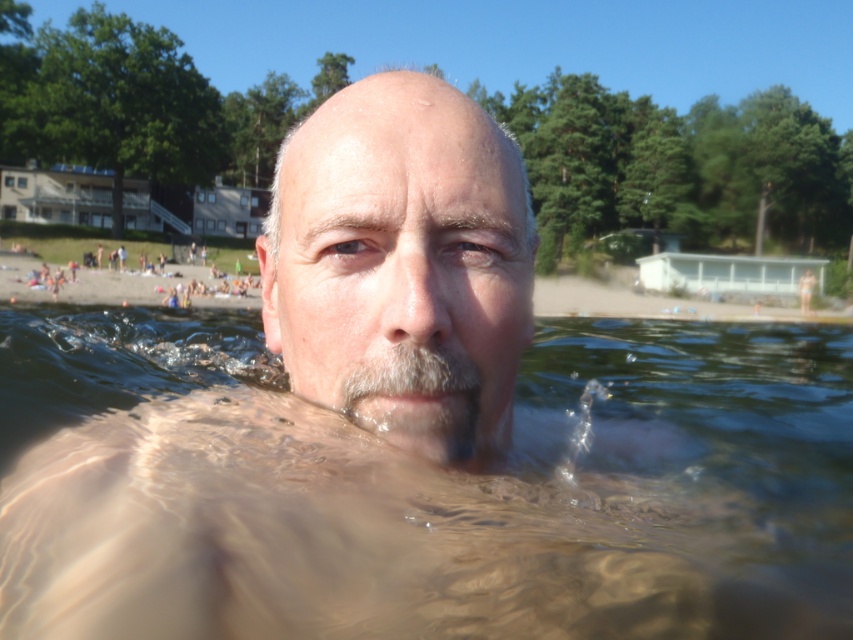
Who is more distant from viewer, [424,403] or [454,321]?

The point [424,403] is more distant.

Identify the location of gray matte beard at center. The width and height of the screenshot is (853, 640). (416, 400).

Find the location of a particular element. gray matte beard at center is located at coordinates (416, 400).

Is smooth skin face at center to the left of gray matte beard at center from the viewer's perspective?

Yes, smooth skin face at center is to the left of gray matte beard at center.

Between point (425, 125) and point (421, 436), which one is positioned behind?

Positioned behind is point (421, 436).

The image size is (853, 640). I want to click on smooth skin face at center, so click(x=402, y=275).

Looking at this image, is clear water at center shorter than smooth skin face at center?

Yes, clear water at center is shorter than smooth skin face at center.

Can you confirm if clear water at center is taller than smooth skin face at center?

No.

Which is behind, point (572, 624) or point (344, 298)?

The point (344, 298) is more distant.

The image size is (853, 640). Identify the location of clear water at center. (422, 490).